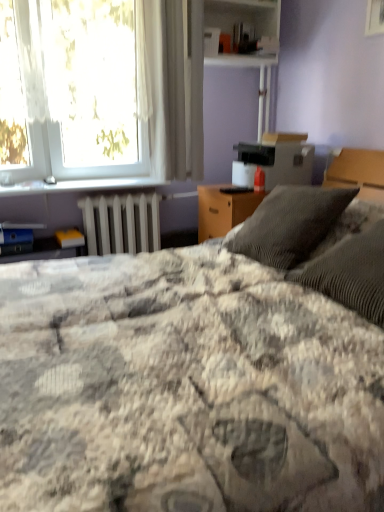
Describe the element at coordinates (59, 97) in the screenshot. Image resolution: width=384 pixels, height=512 pixels. I see `white sheer curtain at upper left` at that location.

The height and width of the screenshot is (512, 384). Find the location of `white metallic radiator at lower left`. white metallic radiator at lower left is located at coordinates (121, 223).

Image resolution: width=384 pixels, height=512 pixels. I want to click on fluffy gray blanket at center, so click(x=184, y=388).

The width and height of the screenshot is (384, 512). Describe the element at coordinates (80, 185) in the screenshot. I see `metallic silver window sill at upper left` at that location.

Describe the element at coordinates (244, 15) in the screenshot. The width and height of the screenshot is (384, 512). I see `white plastic shelf at upper center` at that location.

Locate an element on the screen. The image size is (384, 512). white sheer curtain at upper left is located at coordinates (59, 97).

From a real-world perspective, is white metallic radiator at lower left located higher than metallic silver window sill at upper left?

No, from a real-world perspective, white metallic radiator at lower left is not above metallic silver window sill at upper left.

In terms of size, does white metallic radiator at lower left appear bigger or smaller than metallic silver window sill at upper left?

In the image, white metallic radiator at lower left appears to be larger than metallic silver window sill at upper left.

Which object is positioned more to the left, white metallic radiator at lower left or metallic silver window sill at upper left?

metallic silver window sill at upper left.

Between metallic silver window sill at upper left and fluffy gray blanket at center, which one appears on the left side from the viewer's perspective?

From the viewer's perspective, metallic silver window sill at upper left appears more on the left side.

From a real-world perspective, between metallic silver window sill at upper left and fluffy gray blanket at center, who is vertically higher?

In real-world perspective, metallic silver window sill at upper left is above.

Is metallic silver window sill at upper left facing away from fluffy gray blanket at center?

No, metallic silver window sill at upper left's orientation is not away from fluffy gray blanket at center.

Is there a large distance between white sheer curtain at upper left and fluffy gray blanket at center?

Yes, white sheer curtain at upper left and fluffy gray blanket at center are quite far apart.

In the scene shown: Can you tell me how much white sheer curtain at upper left and fluffy gray blanket at center differ in facing direction?

white sheer curtain at upper left and fluffy gray blanket at center are facing 90 degrees away from each other.

Based on their sizes in the image, would you say white sheer curtain at upper left is bigger or smaller than fluffy gray blanket at center?

Considering their sizes, white sheer curtain at upper left takes up less space than fluffy gray blanket at center.

Is fluffy gray blanket at center at the back of white sheer curtain at upper left?

white sheer curtain at upper left does not have its back to fluffy gray blanket at center.

Is white sheer curtain at upper left not inside white sheer curtain at upper center?

white sheer curtain at upper left lies outside white sheer curtain at upper center's area.

Considering the relative sizes of white sheer curtain at upper left and white sheer curtain at upper center in the image provided, is white sheer curtain at upper left smaller than white sheer curtain at upper center?

No, white sheer curtain at upper left is not smaller than white sheer curtain at upper center.

Which object is positioned more to the right, white sheer curtain at upper left or white sheer curtain at upper center?

From the viewer's perspective, white sheer curtain at upper center appears more on the right side.

Would you consider fluffy gray blanket at center to be distant from white plastic shelf at upper center?

fluffy gray blanket at center is positioned a significant distance from white plastic shelf at upper center.

Between fluffy gray blanket at center and white plastic shelf at upper center, which one has larger size?

fluffy gray blanket at center is bigger.

Does fluffy gray blanket at center lie in front of white plastic shelf at upper center?

Yes, fluffy gray blanket at center is closer to the viewer.

Which of these two, fluffy gray blanket at center or white plastic shelf at upper center, is wider?

fluffy gray blanket at center is wider.

Considering their positions, is fluffy gray blanket at center located in front of or behind white metallic radiator at lower left?

Visually, fluffy gray blanket at center is located in front of white metallic radiator at lower left.

Can you confirm if fluffy gray blanket at center is thinner than white metallic radiator at lower left?

No, fluffy gray blanket at center is not thinner than white metallic radiator at lower left.

Considering the relative sizes of fluffy gray blanket at center and white metallic radiator at lower left in the image provided, is fluffy gray blanket at center bigger than white metallic radiator at lower left?

Correct, fluffy gray blanket at center is larger in size than white metallic radiator at lower left.

Is fluffy gray blanket at center aimed at white metallic radiator at lower left?

No.

From the image's perspective, would you say metallic silver window sill at upper left is shown under white sheer curtain at upper left?

Yes, from the image's perspective, metallic silver window sill at upper left is below white sheer curtain at upper left.

From a real-world perspective, between metallic silver window sill at upper left and white sheer curtain at upper left, who is vertically lower?

metallic silver window sill at upper left is physically lower.

The width and height of the screenshot is (384, 512). I want to click on window located above the metallic silver window sill at upper left (from a real-world perspective), so click(59, 97).

Image resolution: width=384 pixels, height=512 pixels. In order to click on radiator lying on the right of metallic silver window sill at upper left in this screenshot , I will do (x=121, y=223).

You are a GUI agent. You are given a task and a screenshot of the screen. Output one action in this format:
    pyautogui.click(x=<x>, y=<y>)
    Task: Click on the window sill above the fluffy gray blanket at center (from a real-world perspective)
    
    Given the screenshot: What is the action you would take?
    pyautogui.click(x=80, y=185)

From the image, which object appears to be nearer to metallic silver window sill at upper left, white sheer curtain at upper left or fluffy gray blanket at center?

The object closer to metallic silver window sill at upper left is white sheer curtain at upper left.

Which object lies nearer to the anchor point white plastic shelf at upper center, white metallic radiator at lower left or fluffy gray blanket at center?

The object closer to white plastic shelf at upper center is white metallic radiator at lower left.

Considering their positions, is white sheer curtain at upper left positioned further to metallic silver window sill at upper left than white sheer curtain at upper center?

The object further to metallic silver window sill at upper left is white sheer curtain at upper center.

From the image, which object appears to be farther from white plastic shelf at upper center, white sheer curtain at upper left or white metallic radiator at lower left?

Among the two, white metallic radiator at lower left is located further to white plastic shelf at upper center.

Based on the photo, based on their spatial positions, is white metallic radiator at lower left or white sheer curtain at upper center closer to white sheer curtain at upper left?

white sheer curtain at upper center is closer to white sheer curtain at upper left.

In the scene shown: Estimate the real-world distances between objects in this image. Which object is further from white sheer curtain at upper left, metallic silver window sill at upper left or white plastic shelf at upper center?

The object further to white sheer curtain at upper left is white plastic shelf at upper center.

From the image, which object appears to be nearer to white metallic radiator at lower left, metallic silver window sill at upper left or white sheer curtain at upper left?

metallic silver window sill at upper left is closer to white metallic radiator at lower left.

Based on their spatial positions, is metallic silver window sill at upper left or white metallic radiator at lower left further from white sheer curtain at upper center?

metallic silver window sill at upper left lies further to white sheer curtain at upper center than the other object.

This screenshot has width=384, height=512. Identify the location of window sill located between fluffy gray blanket at center and white plastic shelf at upper center in the depth direction. (80, 185).

Locate an element on the screen. The height and width of the screenshot is (512, 384). window sill that lies between white sheer curtain at upper center and white metallic radiator at lower left from top to bottom is located at coordinates (80, 185).

You are a GUI agent. You are given a task and a screenshot of the screen. Output one action in this format:
    pyautogui.click(x=<x>, y=<y>)
    Task: Click on the window between fluffy gray blanket at center and white plastic shelf at upper center from front to back
    The image size is (384, 512).
    Given the screenshot: What is the action you would take?
    pyautogui.click(x=59, y=97)

Identify the location of curtain between white plastic shelf at upper center and metallic silver window sill at upper left vertically. The image size is (384, 512). (172, 84).